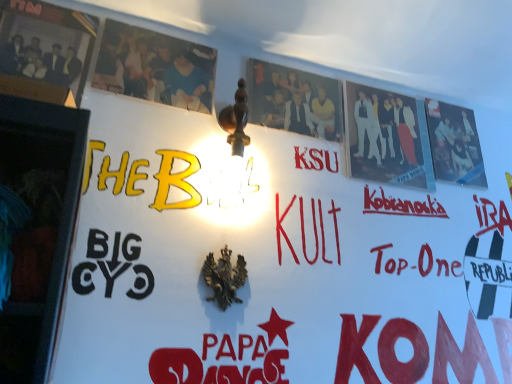
Question: From their relative heights in the image, would you say matte black photo frame at upper left, which is counted as the 1th poster, starting from the left, is taller or shorter than matte paper poster at center, which ranks as the third poster in left-to-right order?

Choices:
 (A) short
 (B) tall

Answer: (B)

Question: From the image's perspective, is matte black photo frame at upper left, which is counted as the 1th poster, starting from the left, positioned above or below matte paper poster at center, which ranks as the third poster in left-to-right order?

Choices:
 (A) above
 (B) below

Answer: (A)

Question: Which object is positioned closest to the matte black photo frame at upper left, which ranks as the fifth poster in right-to-left order?

Choices:
 (A) silhouette paper poster at upper right, which appears as the 2th poster when viewed from the right
 (B) matte paper poster at center, which ranks as the third poster in left-to-right order
 (C) matte paper poster at upper left, which is counted as the second poster, starting from the left
 (D) matte black poster at upper right, which ranks as the fifth poster in left-to-right order

Answer: (C)

Question: Which is farther from the matte paper poster at center, which ranks as the third poster in right-to-left order?

Choices:
 (A) matte black photo frame at upper left, which is counted as the 1th poster, starting from the left
 (B) matte black poster at upper right, positioned as the first poster in right-to-left order
 (C) matte paper poster at upper left, which is counted as the second poster, starting from the left
 (D) silhouette paper poster at upper right, the 4th poster viewed from the left

Answer: (A)